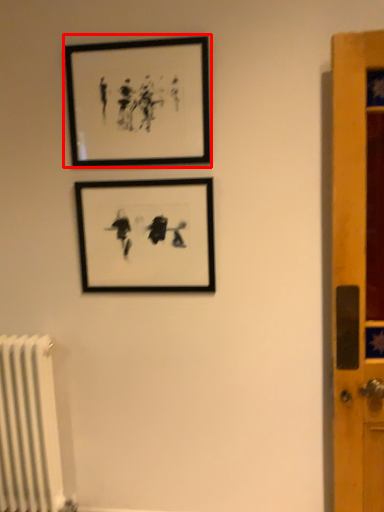
Question: From the image's perspective, where is picture frame (annotated by the red box) located in relation to picture frame in the image?

Choices:
 (A) below
 (B) above

Answer: (B)